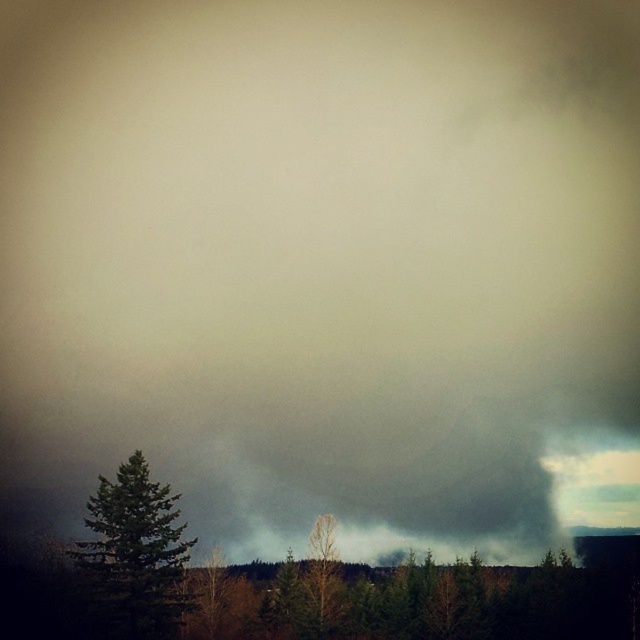
You are a drone operator trying to navigate through a forest fire. You see the green matte trees at lower center. Based on their position, can you estimate how far they are from the origin point?

The green matte trees at lower center are located at point (499, 598), so they are approximately 1.22 meters away from the origin point.

You are a firefighter assessing the situation from a helicopter. You notice two groups of trees below you. One is labeled as green matte trees at lower center and the other as green matte tree at center. Which group is closer to your current position?

The green matte trees at lower center are closer to your current position because they are positioned in front of the green matte tree at center.